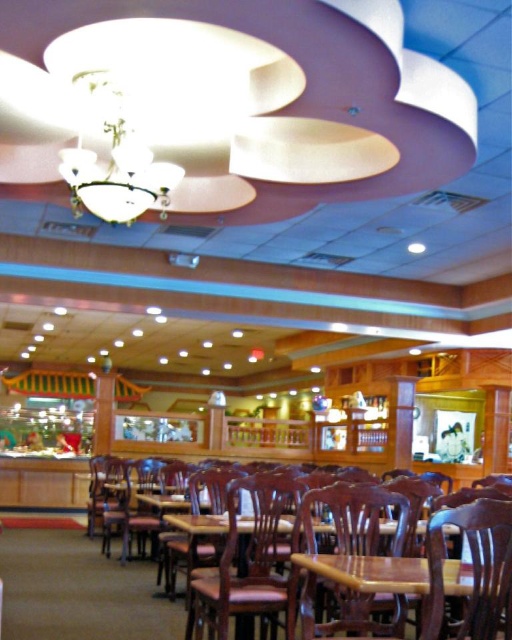
Question: Which point appears closest to the camera in this image?

Choices:
 (A) (175, 480)
 (B) (442, 616)
 (C) (339, 486)

Answer: (B)

Question: Is brown wood chair at center to the right of wooden chair at lower right from the viewer's perspective?

Choices:
 (A) yes
 (B) no

Answer: (B)

Question: Can you confirm if wooden chair at center is positioned below mahogany wood chair at center?

Choices:
 (A) no
 (B) yes

Answer: (A)

Question: Estimate the real-world distances between objects in this image. Which object is farther from the wooden chair at lower right?

Choices:
 (A) mahogany wood chair at center
 (B) wooden chair at center
 (C) wooden table at center

Answer: (A)

Question: Which object is positioned farthest from the wooden table at center?

Choices:
 (A) wooden chair at lower right
 (B) wooden chair at center
 (C) mahogany wood chair at center
 (D) brown wood chair at center

Answer: (C)

Question: Is wooden chair at lower right to the left of mahogany wood chair at center from the viewer's perspective?

Choices:
 (A) yes
 (B) no

Answer: (B)